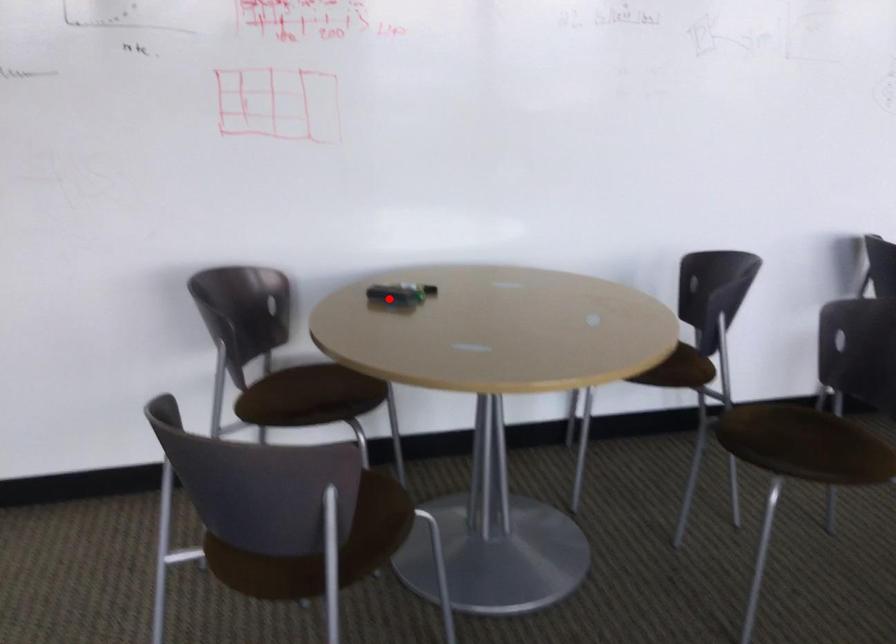
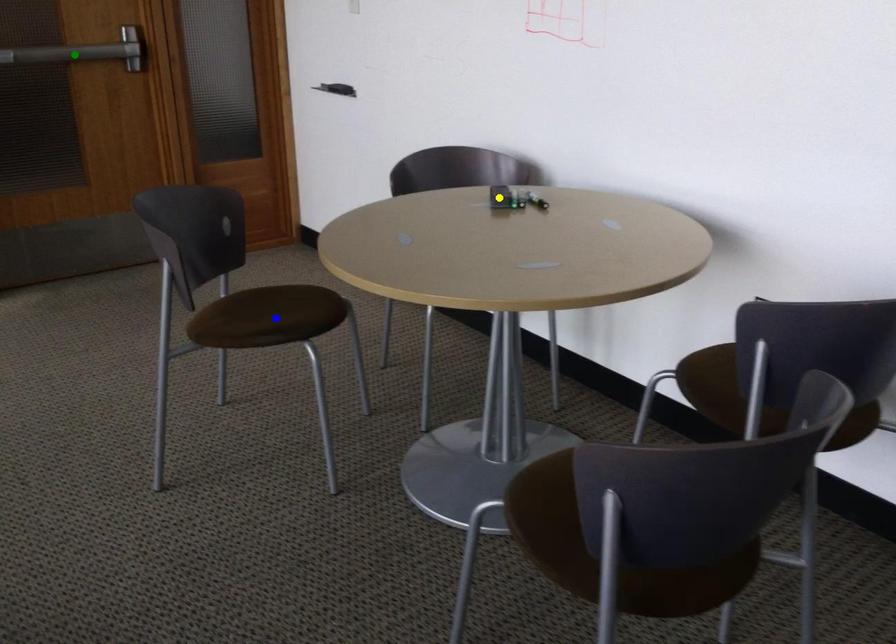
Question: I am providing you with two images of the same scene from different viewpoints. A red point is marked on the first image. You are given multiple points on the second image. Which point in image 2 represents the same 3d spot as the red point in image 1?

Choices:
 (A) blue point
 (B) green point
 (C) yellow point

Answer: (C)